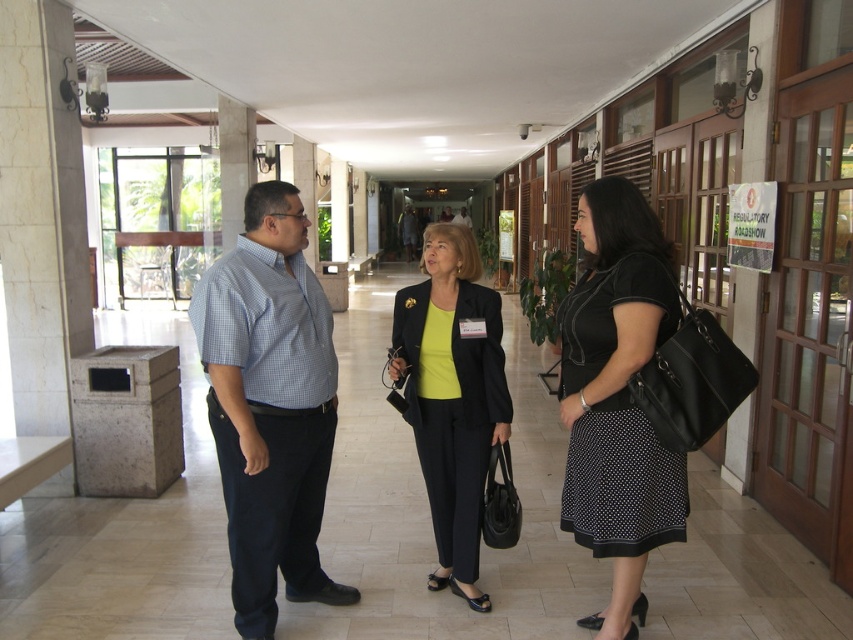
Question: Is black dotted skirt at center above matte black blazer at center?

Choices:
 (A) no
 (B) yes

Answer: (B)

Question: Is blue checkered shirt at center behind matte black blazer at center?

Choices:
 (A) no
 (B) yes

Answer: (A)

Question: Which point appears farthest from the camera in this image?

Choices:
 (A) (271, 454)
 (B) (581, 301)
 (C) (444, 422)

Answer: (C)

Question: Is blue checkered shirt at center behind black dotted skirt at center?

Choices:
 (A) no
 (B) yes

Answer: (B)

Question: Among these objects, which one is farthest from the camera?

Choices:
 (A) blue checkered shirt at center
 (B) black dotted skirt at center

Answer: (A)

Question: Among these points, which one is farthest from the camera?

Choices:
 (A) (265, 536)
 (B) (454, 508)

Answer: (B)